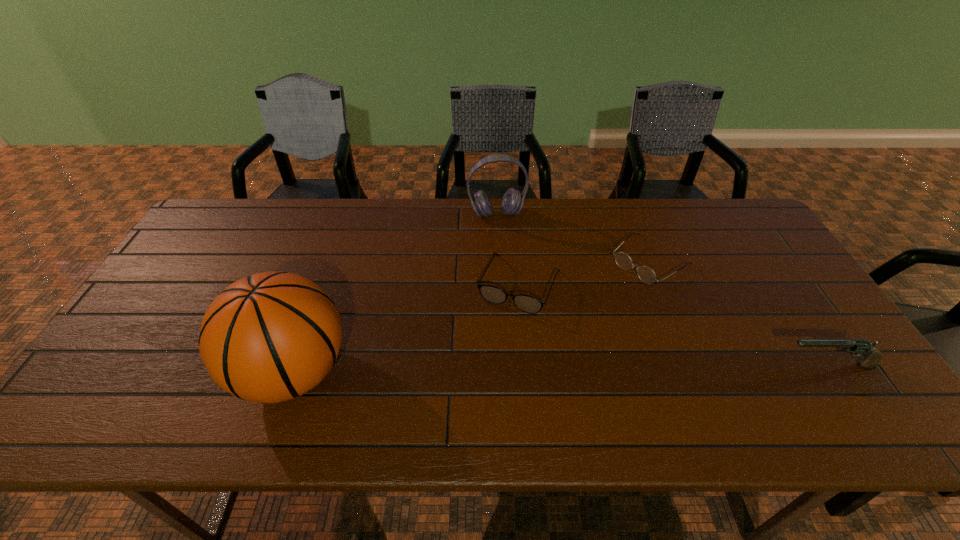
Where is `vacant space at the left edge of the desktop`? vacant space at the left edge of the desktop is located at coordinates pos(233,258).

In the image, there is a desktop. Identify the location of free space at the right edge. (816, 313).

Identify the location of vacant space at the far left corner of the desktop. This screenshot has height=540, width=960. (225, 213).

Identify the location of vacant region at the near left corner of the desktop. This screenshot has width=960, height=540. (153, 393).

The image size is (960, 540). In the image, there is a desktop. What are the coordinates of `blank space at the far right corner` in the screenshot? It's located at (719, 205).

The image size is (960, 540). I want to click on empty space between the second tallest object and the tallest object, so click(x=396, y=293).

Where is `free space between the headset and the third shortest object`? The height and width of the screenshot is (540, 960). free space between the headset and the third shortest object is located at coordinates (662, 289).

Where is `free area in between the third tallest object and the farthest object`? This screenshot has width=960, height=540. free area in between the third tallest object and the farthest object is located at coordinates 662,289.

Find the location of `blank region between the tallest object and the third shortest object`. blank region between the tallest object and the third shortest object is located at coordinates (561, 369).

The height and width of the screenshot is (540, 960). I want to click on vacant area that lies between the fourth shortest object and the left spectacles, so click(x=508, y=249).